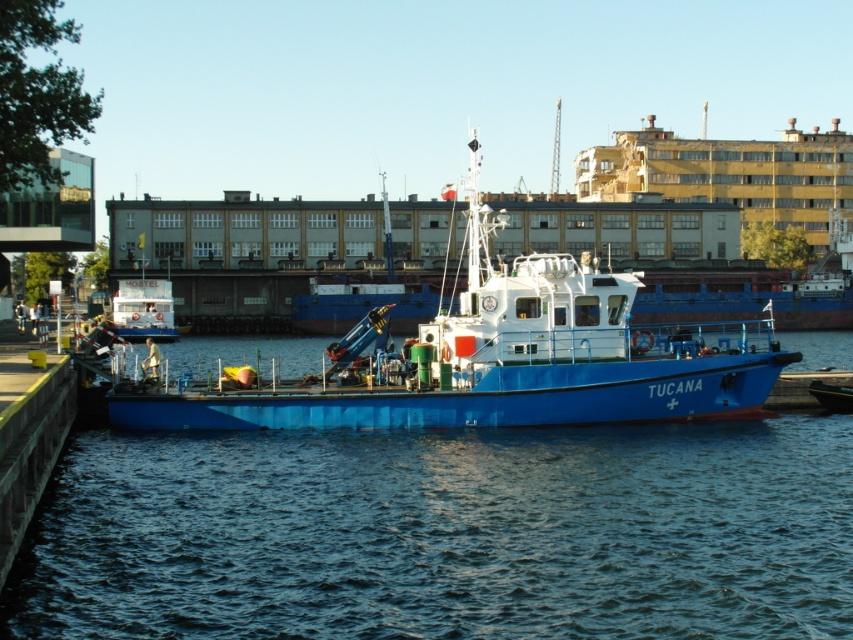
Which is in front, point (660, 413) or point (138, 296)?

Positioned in front is point (660, 413).

Between blue matte boat at center and white glossy boat at center, which one is positioned lower?

white glossy boat at center is lower down.

Is point (549, 419) positioned behind point (152, 282)?

No, it is in front of (152, 282).

Where is `blue matte boat at center`? The image size is (853, 640). blue matte boat at center is located at coordinates (498, 358).

Which is more to the right, blue rubber boat at center or blue matte boat at center?

Positioned to the right is blue matte boat at center.

Is blue rubber boat at center to the left of blue matte boat at center from the viewer's perspective?

Correct, you'll find blue rubber boat at center to the left of blue matte boat at center.

This screenshot has width=853, height=640. Describe the element at coordinates (445, 532) in the screenshot. I see `blue rubber boat at center` at that location.

At what (x,y) coordinates should I click in order to perform the action: click on blue rubber boat at center. Please return your answer as a coordinate pair (x, y). Looking at the image, I should click on (445, 532).

Looking at this image, is blue rubber boat at center to the right of white glossy boat at center from the viewer's perspective?

Yes, blue rubber boat at center is to the right of white glossy boat at center.

Which is behind, point (78, 609) or point (140, 316)?

The point (140, 316) is more distant.

Is point (480, 618) positioned behind point (140, 288)?

No, (480, 618) is closer to viewer.

Where is `blue rubber boat at center`? This screenshot has height=640, width=853. blue rubber boat at center is located at coordinates (445, 532).